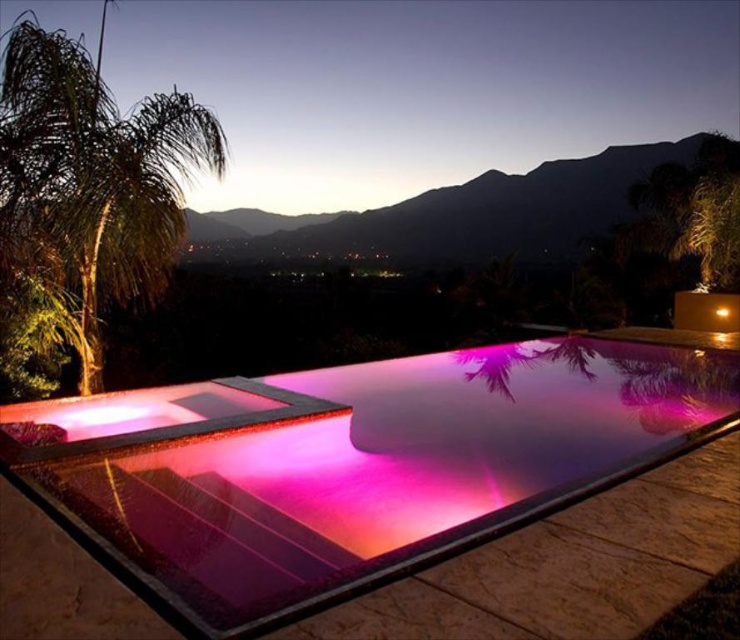
Between point (370, 502) and point (20, 104), which one is positioned behind?

The point (20, 104) is behind.

Is purple glass pool at center in front of green leafy palm tree at left?

Yes, purple glass pool at center is in front of green leafy palm tree at left.

Locate an element on the screen. purple glass pool at center is located at coordinates 369,467.